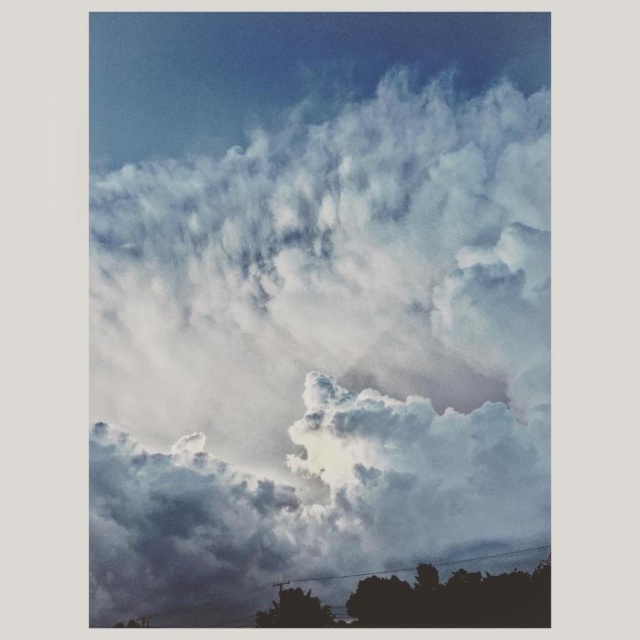
Between white fluffy cloud at center and silhouette tree at lower center, which one appears on the left side from the viewer's perspective?

From the viewer's perspective, silhouette tree at lower center appears more on the left side.

Is point (102, 275) closer to camera compared to point (321, 602)?

No.

Is point (92, 317) closer to viewer compared to point (301, 595)?

No, (92, 317) is behind (301, 595).

I want to click on white fluffy cloud at center, so click(321, 349).

From the picture: Is silhouette tree at bottom further to the viewer compared to silhouette tree at lower center?

No, it is in front of silhouette tree at lower center.

Locate an element on the screen. This screenshot has height=640, width=640. silhouette tree at bottom is located at coordinates (424, 602).

How far apart are white fluffy cloud at center and silhouette tree at bottom?

white fluffy cloud at center and silhouette tree at bottom are 23.28 meters apart from each other.

Which is in front, point (179, 209) or point (436, 580)?

Point (436, 580) is more forward.

The image size is (640, 640). I want to click on white fluffy cloud at center, so click(321, 349).